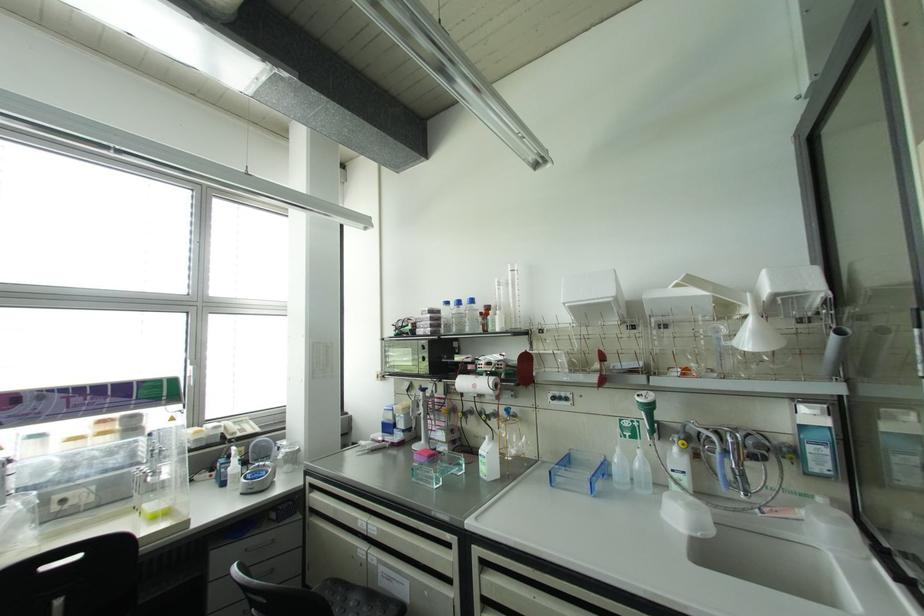
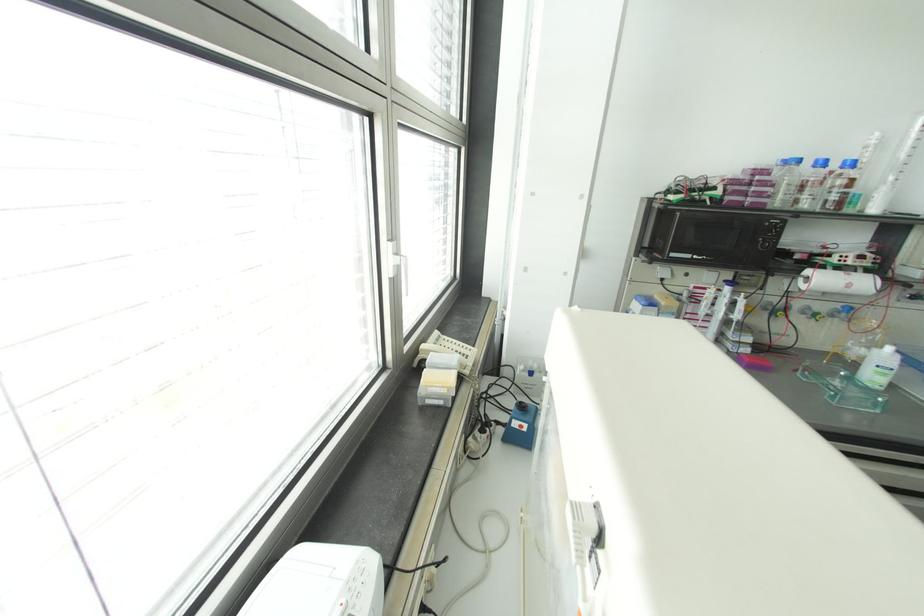
In the second image, find the point that corresponds to [506,410] in the first image.

(848, 309)